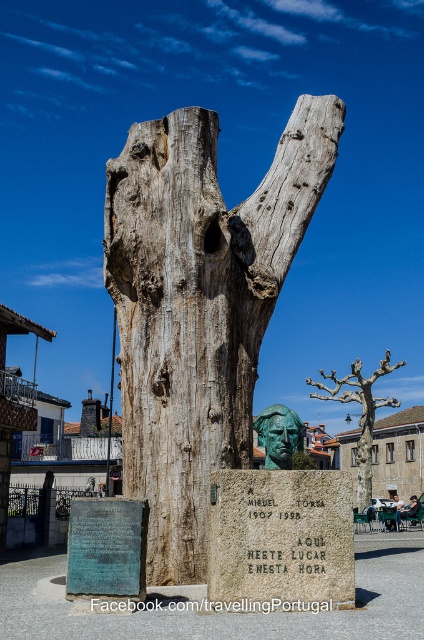
Question: Does weathered wood tree trunk at center lie behind green patina bronze bust at center?

Choices:
 (A) yes
 (B) no

Answer: (A)

Question: Does bare wood tree at center have a greater width compared to green patina bronze bust at center?

Choices:
 (A) yes
 (B) no

Answer: (A)

Question: Based on their relative distances, which object is nearer to the bare wood tree at center?

Choices:
 (A) weathered wood tree trunk at center
 (B) green patina bronze bust at center

Answer: (A)

Question: Which point appears farthest from the camera in this image?

Choices:
 (A) pyautogui.click(x=175, y=346)
 (B) pyautogui.click(x=257, y=419)
 (C) pyautogui.click(x=315, y=394)

Answer: (C)

Question: Estimate the real-world distances between objects in this image. Which object is farther from the weathered wood tree trunk at center?

Choices:
 (A) green patina bronze bust at center
 (B) bare wood tree at center

Answer: (B)

Question: Is bare wood tree at center bigger than green patina bronze bust at center?

Choices:
 (A) no
 (B) yes

Answer: (B)